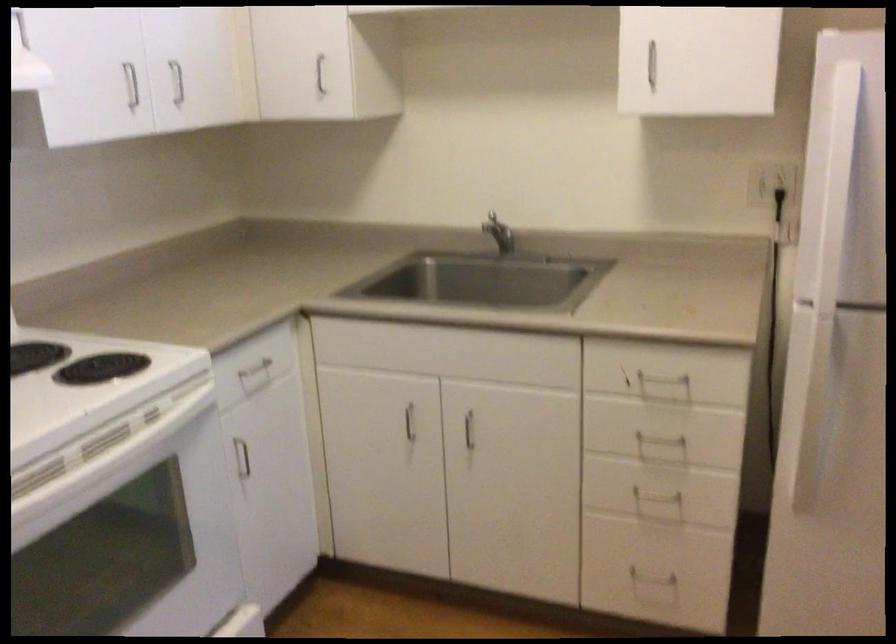
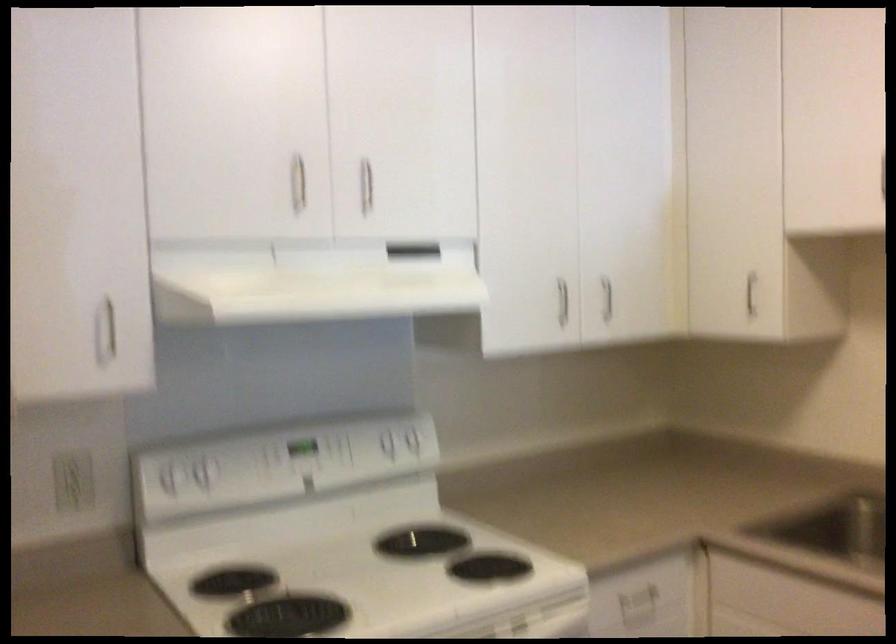
Question: I am providing you with two images of the same scene from different viewpoints. After the viewpoint changes to image2, which objects are now occluded?

Choices:
 (A) white stove knob
 (B) white power outlet
 (C) white cabinet handle
 (D) none of these

Answer: (D)